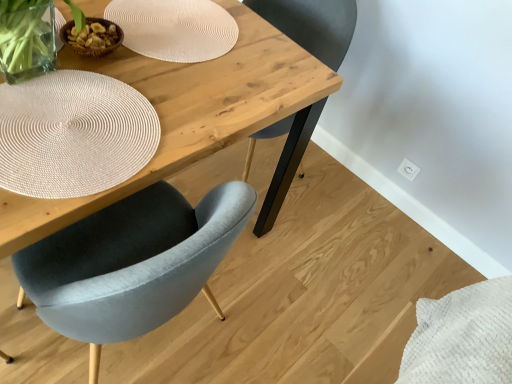
The width and height of the screenshot is (512, 384). I want to click on natural wood table at center, so click(196, 119).

Describe the element at coordinates (174, 28) in the screenshot. This screenshot has height=384, width=512. I see `white textured placemat at upper center, the 1th paper plate positioned from the top` at that location.

This screenshot has height=384, width=512. In order to click on velvet grey chair at center in this screenshot , I will do `click(313, 25)`.

Based on the photo, how much space does white woven placemat at upper left, arranged as the second paper plate when viewed from the top, occupy horizontally?

38.87 centimeters.

Where is `natural wood table at center`? The height and width of the screenshot is (384, 512). natural wood table at center is located at coordinates 196,119.

From the image's perspective, which one is positioned lower, white woven placemat at upper left, which ranks as the 2th paper plate in back-to-front order, or natural wood table at center?

natural wood table at center is shown below in the image.

I want to click on paper plate that is the 1st one when counting upward from the natural wood table at center (from the image's perspective), so click(x=73, y=134).

Could you tell me if white woven placemat at upper left, arranged as the second paper plate when viewed from the top, is facing natural wood table at center?

Yes.

Is natural wood table at center facing away from velvet grey chair at center?

natural wood table at center is not turned away from velvet grey chair at center.

Which object is wider, natural wood table at center or velvet grey chair at center?

With larger width is natural wood table at center.

Does natural wood table at center have a greater height compared to velvet grey chair at center?

In fact, natural wood table at center may be shorter than velvet grey chair at center.

Can you tell me how much velvet grey chair at center and white woven placemat at upper left, acting as the 1th paper plate starting from the bottom, differ in facing direction?

There is a 91.3-degree angle between the facing directions of velvet grey chair at center and white woven placemat at upper left, acting as the 1th paper plate starting from the bottom.

From a real-world perspective, who is located lower, velvet grey chair at center or white woven placemat at upper left, which ranks as the 1th paper plate in front-to-back order?

velvet grey chair at center.

Does velvet grey chair at center contain white woven placemat at upper left, arranged as the second paper plate when viewed from the top?

No, white woven placemat at upper left, arranged as the second paper plate when viewed from the top, is not a part of velvet grey chair at center.

Is velvet grey chair at center positioned far away from white woven placemat at upper left, arranged as the second paper plate when viewed from the top?

velvet grey chair at center is actually quite close to white woven placemat at upper left, arranged as the second paper plate when viewed from the top.

You are a GUI agent. You are given a task and a screenshot of the screen. Output one action in this format:
    pyautogui.click(x=<x>, y=<y>)
    Task: Click on the paper plate lying in front of the white textured placemat at upper center, the 2th paper plate viewed from the front
    This screenshot has height=384, width=512.
    Given the screenshot: What is the action you would take?
    pyautogui.click(x=73, y=134)

Which of these two, white textured placemat at upper center, the 2th paper plate viewed from the front, or white woven placemat at upper left, arranged as the second paper plate when viewed from the top, is wider?

With larger width is white textured placemat at upper center, the 2th paper plate viewed from the front.

From a real-world perspective, is white textured placemat at upper center, the 2th paper plate viewed from the front, located higher than white woven placemat at upper left, acting as the 1th paper plate starting from the bottom?

Yes.

From the image's perspective, between white textured placemat at upper center, the 2th paper plate viewed from the front, and white woven placemat at upper left, which ranks as the 2th paper plate in back-to-front order, which one is located above?

white textured placemat at upper center, the 2th paper plate viewed from the front, from the image's perspective.

Is white woven placemat at upper left, acting as the 1th paper plate starting from the bottom, closer to camera compared to velvet grey chair at center?

Yes, it is in front of velvet grey chair at center.

In the scene shown: Which is more to the left, white woven placemat at upper left, which ranks as the 1th paper plate in front-to-back order, or velvet grey chair at center?

white woven placemat at upper left, which ranks as the 1th paper plate in front-to-back order.

Where is `paper plate below the velvet grey chair at center (from the image's perspective)`? paper plate below the velvet grey chair at center (from the image's perspective) is located at coordinates (73, 134).

Measure the distance between white woven placemat at upper left, which ranks as the 2th paper plate in back-to-front order, and velvet grey chair at center.

white woven placemat at upper left, which ranks as the 2th paper plate in back-to-front order, and velvet grey chair at center are 65.20 centimeters apart from each other.

Can you confirm if white textured placemat at upper center, which is the second paper plate from bottom to top, is shorter than velvet grey chair at center?

Yes.

Is white textured placemat at upper center, the 1th paper plate positioned from the top, positioned far away from velvet grey chair at center?

No, white textured placemat at upper center, the 1th paper plate positioned from the top, is not far from velvet grey chair at center.

Is point (173, 19) positioned in front of point (283, 120)?

Yes, it is.

Is velvet grey chair at center inside white textured placemat at upper center, the 2th paper plate viewed from the front?

No, velvet grey chair at center is located outside of white textured placemat at upper center, the 2th paper plate viewed from the front.

Can you confirm if natural wood table at center is shorter than white textured placemat at upper center, which is counted as the first paper plate, starting from the back?

In fact, natural wood table at center may be taller than white textured placemat at upper center, which is counted as the first paper plate, starting from the back.

Is natural wood table at center situated inside white textured placemat at upper center, which is the second paper plate from bottom to top, or outside?

natural wood table at center is outside white textured placemat at upper center, which is the second paper plate from bottom to top.

From the picture: Considering the positions of objects natural wood table at center and white textured placemat at upper center, the 1th paper plate positioned from the top, in the image provided, who is in front, natural wood table at center or white textured placemat at upper center, the 1th paper plate positioned from the top,?

natural wood table at center is in front.

At what (x,y) coordinates should I click in order to perform the action: click on the 1st paper plate to the right of the natural wood table at center, starting your count from the anchor. Please return your answer as a coordinate pair (x, y). Looking at the image, I should click on (73, 134).

Image resolution: width=512 pixels, height=384 pixels. In order to click on table that is on the left side of velvet grey chair at center in this screenshot , I will do `click(196, 119)`.

Based on their spatial positions, is white textured placemat at upper center, which is counted as the first paper plate, starting from the back, or natural wood table at center closer to velvet grey chair at center?

natural wood table at center lies closer to velvet grey chair at center than the other object.

Which object lies nearer to the anchor point velvet grey chair at center, natural wood table at center or white textured placemat at upper center, the 1th paper plate positioned from the top?

natural wood table at center.

Estimate the real-world distances between objects in this image. Which object is closer to white woven placemat at upper left, arranged as the second paper plate when viewed from the top, velvet grey chair at center or natural wood table at center?

natural wood table at center is positioned closer to the anchor white woven placemat at upper left, arranged as the second paper plate when viewed from the top.

Looking at the image, which one is located further to natural wood table at center, white textured placemat at upper center, which is counted as the first paper plate, starting from the back, or velvet grey chair at center?

The object further to natural wood table at center is velvet grey chair at center.

From the image, which object appears to be nearer to white textured placemat at upper center, which is the second paper plate from bottom to top, velvet grey chair at center or white woven placemat at upper left, acting as the 1th paper plate starting from the bottom?

Among the two, white woven placemat at upper left, acting as the 1th paper plate starting from the bottom, is located nearer to white textured placemat at upper center, which is the second paper plate from bottom to top.

Considering their positions, is white woven placemat at upper left, arranged as the second paper plate when viewed from the top, positioned closer to natural wood table at center than white textured placemat at upper center, the 1th paper plate positioned from the top?

The object closer to natural wood table at center is white textured placemat at upper center, the 1th paper plate positioned from the top.

When comparing their distances from velvet grey chair at center, does white woven placemat at upper left, acting as the 1th paper plate starting from the bottom, or natural wood table at center seem further?

Among the two, white woven placemat at upper left, acting as the 1th paper plate starting from the bottom, is located further to velvet grey chair at center.

From the image, which object appears to be farther from velvet grey chair at center, white textured placemat at upper center, the 2th paper plate viewed from the front, or white woven placemat at upper left, which ranks as the 2th paper plate in back-to-front order?

white woven placemat at upper left, which ranks as the 2th paper plate in back-to-front order.

Identify the location of paper plate positioned between natural wood table at center and white textured placemat at upper center, the 2th paper plate viewed from the front, from near to far. The image size is (512, 384). (73, 134).

At what (x,y) coordinates should I click in order to perform the action: click on paper plate positioned between white woven placemat at upper left, arranged as the second paper plate when viewed from the top, and velvet grey chair at center from near to far. Please return your answer as a coordinate pair (x, y). This screenshot has width=512, height=384. Looking at the image, I should click on (174, 28).